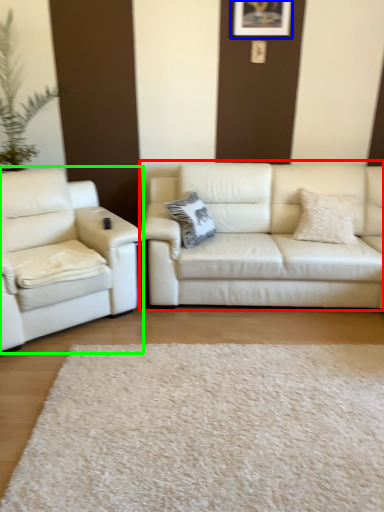
Question: Which is farther away from studio couch (highlighted by a red box)? picture frame (highlighted by a blue box) or studio couch (highlighted by a green box)?

Choices:
 (A) picture frame
 (B) studio couch

Answer: (A)